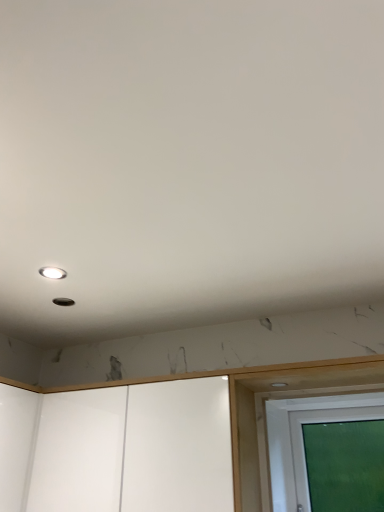
Question: Is transparent glass screen door at lower right, which is the 1th screen door in right-to-left order, located outside white glossy cabinet at lower center, acting as the 2th screen door starting from the right?

Choices:
 (A) yes
 (B) no

Answer: (A)

Question: Does transparent glass screen door at lower right, the 2th screen door in the left-to-right sequence, lie behind white glossy cabinet at lower center, acting as the 2th screen door starting from the right?

Choices:
 (A) no
 (B) yes

Answer: (B)

Question: Is there a large distance between transparent glass screen door at lower right, the 2th screen door in the left-to-right sequence, and white glossy cabinet at lower center, acting as the 2th screen door starting from the right?

Choices:
 (A) yes
 (B) no

Answer: (B)

Question: Is transparent glass screen door at lower right, the 2th screen door in the left-to-right sequence, thinner than white glossy cabinet at lower center, which is counted as the first screen door, starting from the left?

Choices:
 (A) no
 (B) yes

Answer: (B)

Question: Is transparent glass screen door at lower right, which is the 1th screen door in right-to-left order, facing towards white glossy cabinet at lower center, which is counted as the first screen door, starting from the left?

Choices:
 (A) yes
 (B) no

Answer: (B)

Question: Is transparent glass screen door at lower right, which is the 1th screen door in right-to-left order, smaller than white glossy cabinet at lower center, acting as the 2th screen door starting from the right?

Choices:
 (A) yes
 (B) no

Answer: (A)

Question: Can we say matte white droplight at upper left lies outside white glossy cabinet at lower center, acting as the 2th screen door starting from the right?

Choices:
 (A) no
 (B) yes

Answer: (B)

Question: Can you confirm if matte white droplight at upper left is smaller than white glossy cabinet at lower center, which is counted as the first screen door, starting from the left?

Choices:
 (A) yes
 (B) no

Answer: (A)

Question: Is white glossy cabinet at lower center, which is counted as the first screen door, starting from the left, a part of matte white droplight at upper left?

Choices:
 (A) no
 (B) yes

Answer: (A)

Question: From a real-world perspective, is matte white droplight at upper left under white glossy cabinet at lower center, acting as the 2th screen door starting from the right?

Choices:
 (A) no
 (B) yes

Answer: (A)

Question: Is the depth of matte white droplight at upper left greater than that of white glossy cabinet at lower center, which is counted as the first screen door, starting from the left?

Choices:
 (A) no
 (B) yes

Answer: (B)

Question: From a real-world perspective, is matte white droplight at upper left over white glossy cabinet at lower center, which is counted as the first screen door, starting from the left?

Choices:
 (A) yes
 (B) no

Answer: (A)

Question: From a real-world perspective, does white glossy cabinet at lower center, which is counted as the first screen door, starting from the left, sit lower than transparent glass screen door at lower right, the 2th screen door in the left-to-right sequence?

Choices:
 (A) yes
 (B) no

Answer: (B)